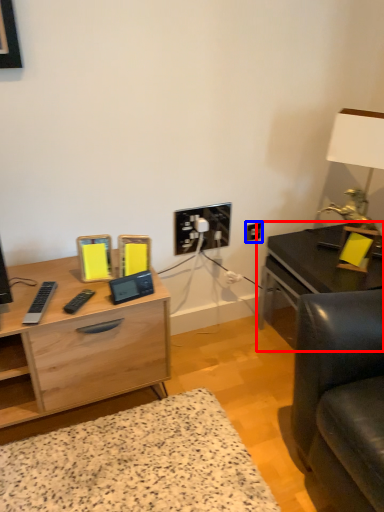
Question: Which object appears farthest to the camera in this image, table (highlighted by a red box) or electric outlet (highlighted by a blue box)?

Choices:
 (A) table
 (B) electric outlet

Answer: (B)